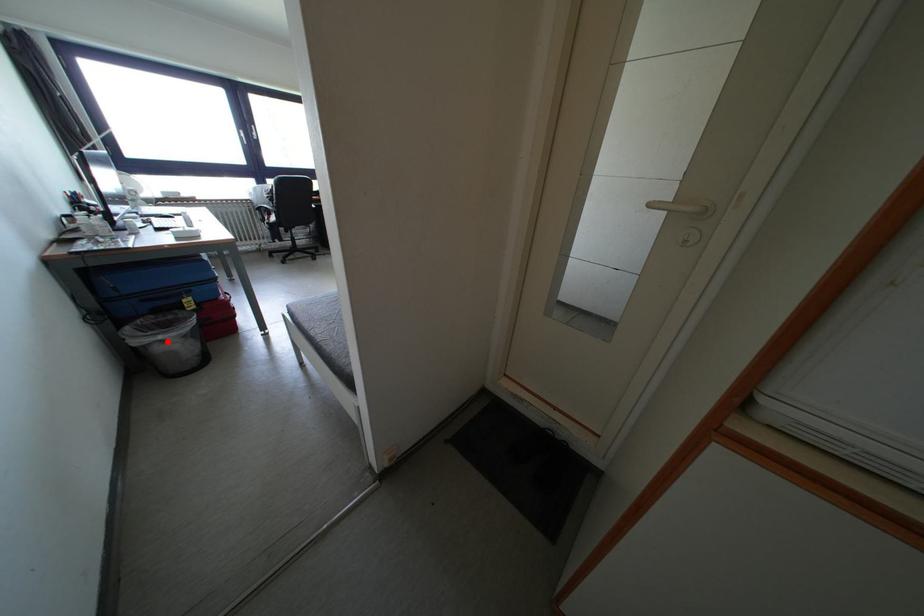
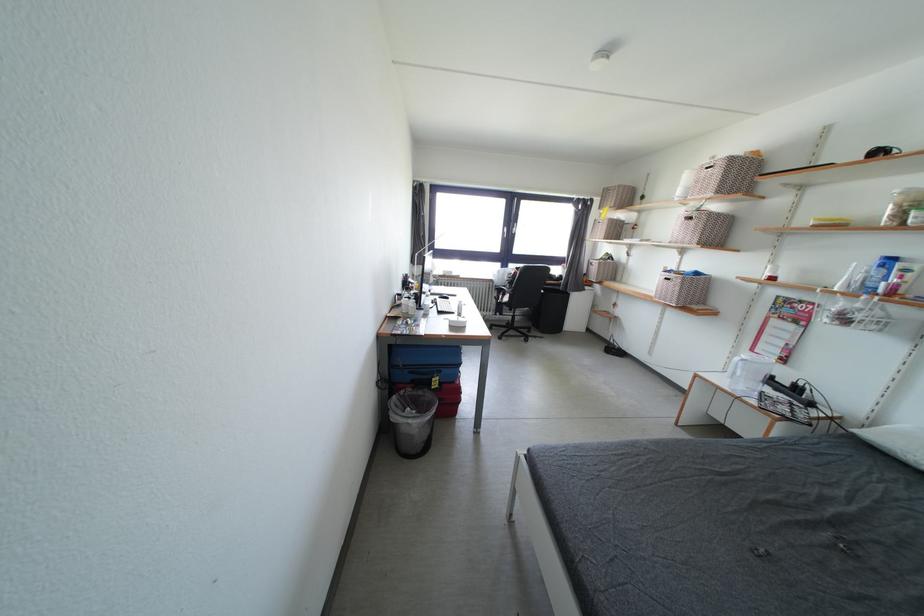
Where in the second image is the point corresponding to the highlighted location from the first image?

(417, 426)